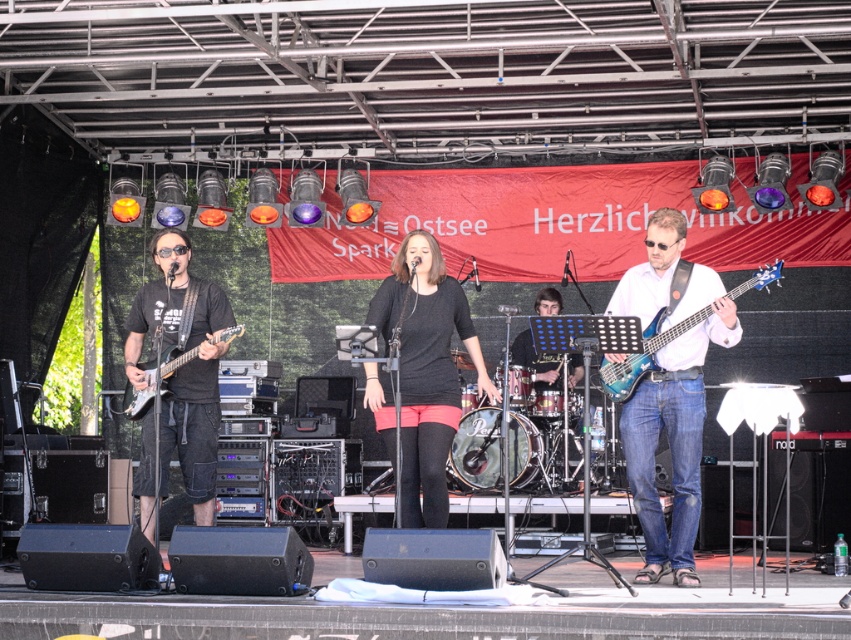
Question: Which of the following is the closest to the observer?

Choices:
 (A) (398, 256)
 (B) (523, 384)

Answer: (A)

Question: Can you confirm if blue glossy bass guitar at right is positioned above green metallic drum at center?

Choices:
 (A) yes
 (B) no

Answer: (A)

Question: Which is nearer to the matte black electric guitar at left?

Choices:
 (A) matte black drum set at center
 (B) blue glossy bass guitar at right
 (C) green metallic drum at center
 (D) translucent blue bass at center

Answer: (D)

Question: Is matte black guitar at left smaller than matte black drum set at center?

Choices:
 (A) no
 (B) yes

Answer: (A)

Question: Which object is farther from the camera taking this photo?

Choices:
 (A) matte black guitar at left
 (B) translucent blue bass at center

Answer: (A)

Question: Is matte black guitar at left closer to camera compared to green metallic drum at center?

Choices:
 (A) yes
 (B) no

Answer: (A)